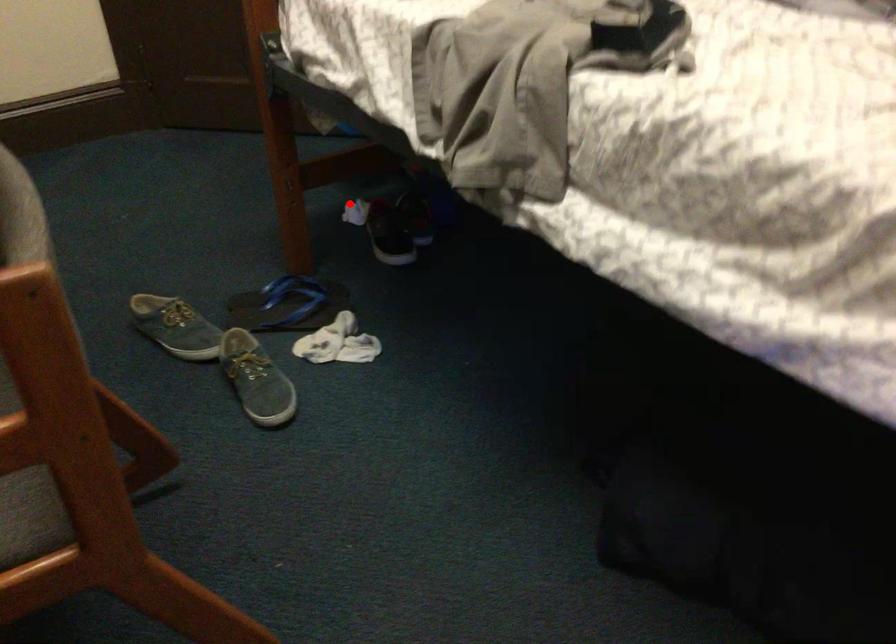
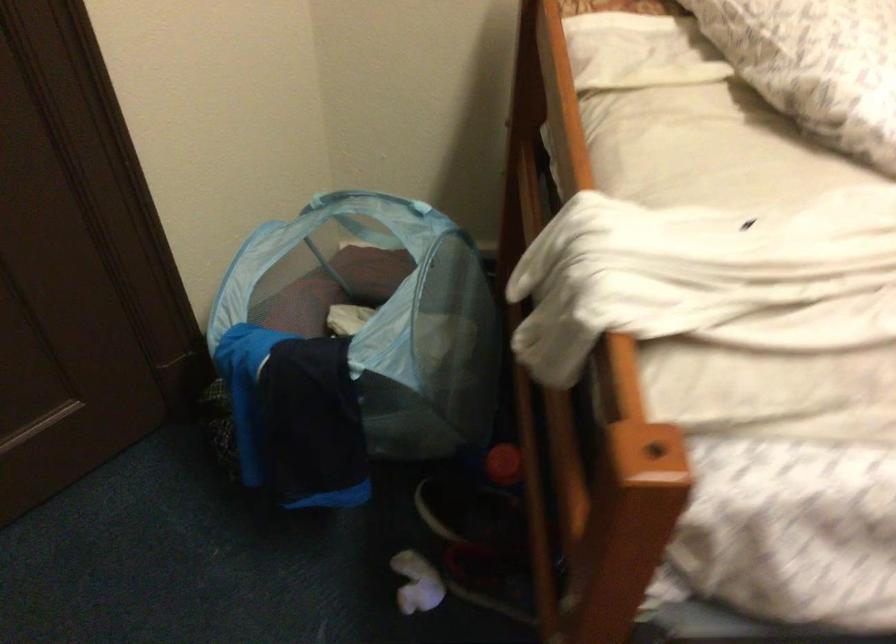
Question: I am providing you with two images of the same scene from different viewpoints. In image1, a red point is highlighted. Considering the same 3D point in image2, which of the following is correct?

Choices:
 (A) It is closer
 (B) It is farther

Answer: (A)